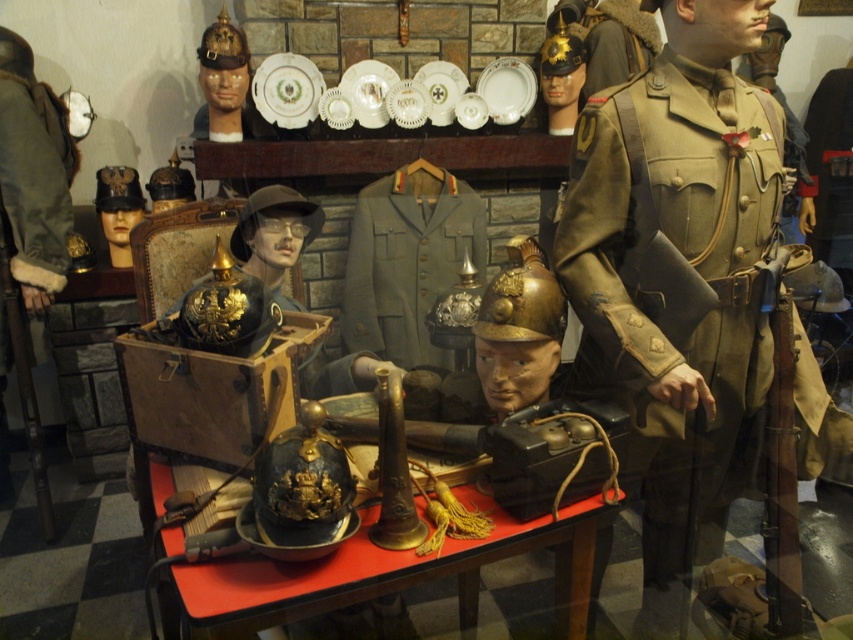
You are standing in front of the historical military artifacts display. There are two points marked on the table covered with a red cloth. The first point is at coordinates point (x=648, y=134) and the second is at point (x=572, y=608). Which point is closer to you?

Point (x=648, y=134) is in front of point (x=572, y=608), so it is closer to you.

You are a museum security guard who needs to monitor both the khaki woolen uniform at center and the camera. What is the minimum distance you need to move to ensure you can watch both items simultaneously?

The khaki woolen uniform at center and camera are 1.47 meters apart from each other. To monitor both simultaneously, you need to position yourself at a point between them, so the minimum distance you need to move is half of 1.47 meters, which is approximately 0.735 meters.